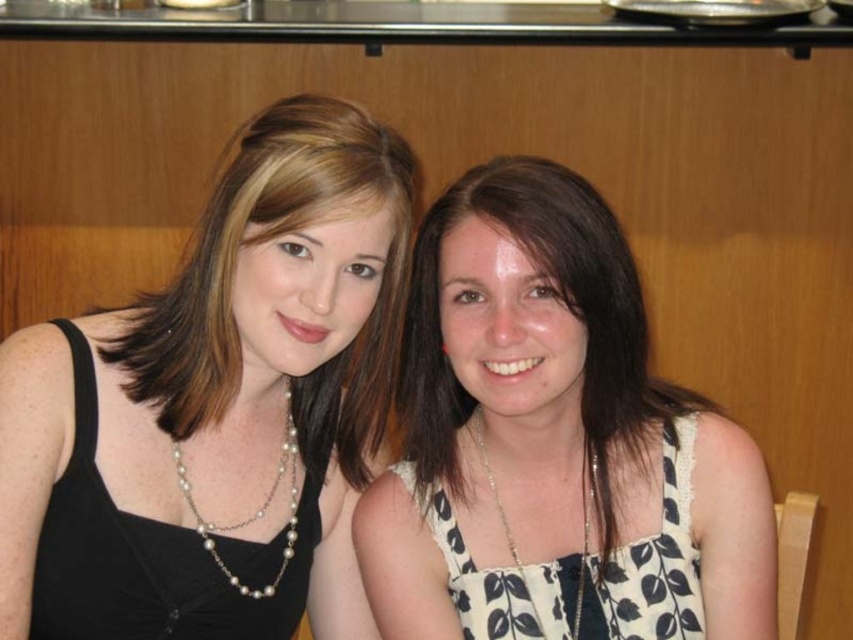
Does pearl necklace at left have a lesser height compared to black satin dress at left?

In fact, pearl necklace at left may be taller than black satin dress at left.

Is point (216, 561) positioned behind point (262, 557)?

No, (216, 561) is closer to viewer.

The height and width of the screenshot is (640, 853). In order to click on pearl necklace at left in this screenshot , I will do `click(218, 408)`.

Which is more to the left, white dotted dress at center or white printed fabric dress at center?

white dotted dress at center

Is point (550, 483) farther from camera compared to point (579, 620)?

That is True.

What do you see at coordinates (553, 438) in the screenshot?
I see `white dotted dress at center` at bounding box center [553, 438].

You are a GUI agent. You are given a task and a screenshot of the screen. Output one action in this format:
    pyautogui.click(x=<x>, y=<y>)
    Task: Click on the white dotted dress at center
    
    Given the screenshot: What is the action you would take?
    pos(553,438)

Does pearl necklace at left appear on the left side of white printed fabric dress at center?

Correct, you'll find pearl necklace at left to the left of white printed fabric dress at center.

Can you confirm if pearl necklace at left is positioned above white printed fabric dress at center?

Yes.

Which is in front, point (242, 422) or point (460, 554)?

Point (460, 554) is more forward.

The image size is (853, 640). I want to click on pearl necklace at left, so click(218, 408).